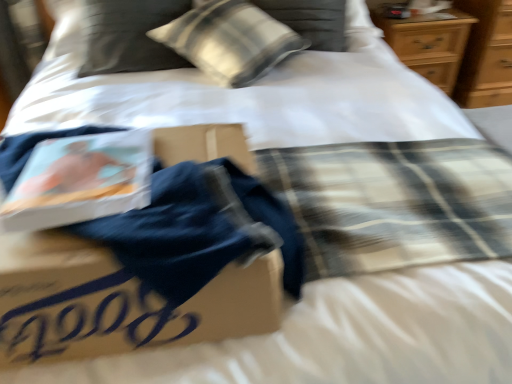
Question: Considering the relative positions of wooden dresser at upper right and white textured pillow at upper center in the image provided, is wooden dresser at upper right to the left of white textured pillow at upper center from the viewer's perspective?

Choices:
 (A) no
 (B) yes

Answer: (A)

Question: Is wooden dresser at upper right next to white textured pillow at upper center?

Choices:
 (A) no
 (B) yes

Answer: (A)

Question: From the image's perspective, does wooden dresser at upper right appear lower than white textured pillow at upper center?

Choices:
 (A) no
 (B) yes

Answer: (A)

Question: Is wooden dresser at upper right outside white textured pillow at upper center?

Choices:
 (A) no
 (B) yes

Answer: (B)

Question: Is wooden dresser at upper right positioned far away from white textured pillow at upper center?

Choices:
 (A) yes
 (B) no

Answer: (A)

Question: Is wooden dresser at upper right smaller than white textured pillow at upper center?

Choices:
 (A) yes
 (B) no

Answer: (B)

Question: Is white textured pillow at upper center to the right of wooden dresser at upper right from the viewer's perspective?

Choices:
 (A) no
 (B) yes

Answer: (A)

Question: Does white textured pillow at upper center come in front of wooden dresser at upper right?

Choices:
 (A) no
 (B) yes

Answer: (B)

Question: Can you confirm if white textured pillow at upper center is wider than wooden dresser at upper right?

Choices:
 (A) no
 (B) yes

Answer: (B)

Question: From the image's perspective, is white textured pillow at upper center under wooden dresser at upper right?

Choices:
 (A) yes
 (B) no

Answer: (A)

Question: Considering the relative sizes of white textured pillow at upper center and wooden dresser at upper right in the image provided, is white textured pillow at upper center bigger than wooden dresser at upper right?

Choices:
 (A) yes
 (B) no

Answer: (B)

Question: Is wooden dresser at upper right at the back of white textured pillow at upper center?

Choices:
 (A) no
 (B) yes

Answer: (A)

Question: Would you say white textured pillow at upper center is inside or outside wooden dresser at upper right?

Choices:
 (A) inside
 (B) outside

Answer: (B)